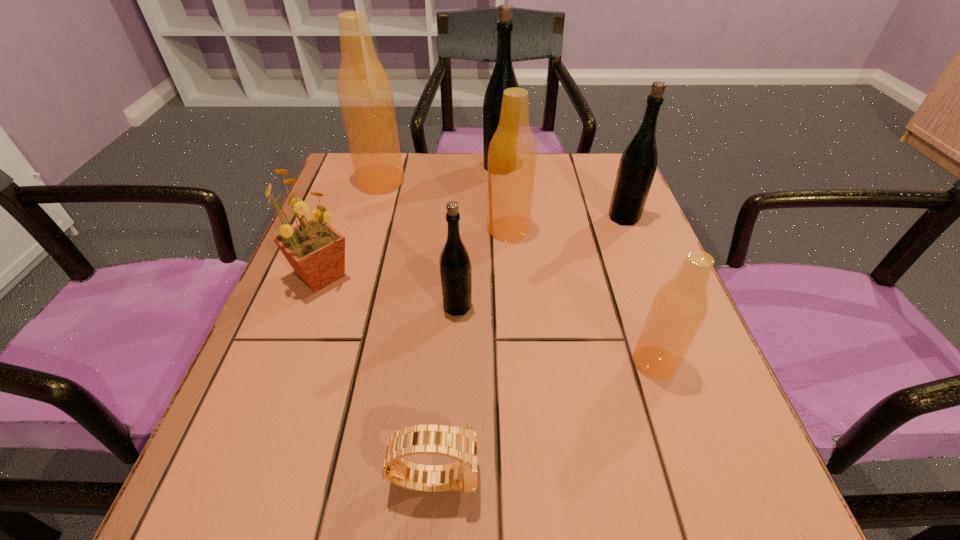
Image resolution: width=960 pixels, height=540 pixels. Identify the location of vacant space at the near left corner of the desktop. (282, 499).

Where is `blank area at the far right corner`? This screenshot has height=540, width=960. blank area at the far right corner is located at coordinates (597, 204).

Identify the location of vacant region at the near right corner. (664, 498).

Identify the location of vacant area between the second farthest green beer bottle and the second green beer bottle from left to right. Image resolution: width=960 pixels, height=540 pixels. 562,192.

Find the location of `free spot between the second nearest object and the leftmost beer bottle`. free spot between the second nearest object and the leftmost beer bottle is located at coordinates (517, 272).

You are a GUI agent. You are given a task and a screenshot of the screen. Output one action in this format:
    pyautogui.click(x=<x>, y=<y>)
    Task: Click on the vacant region between the shortest object and the leftmost beer bottle
    The width and height of the screenshot is (960, 540).
    Given the screenshot: What is the action you would take?
    pyautogui.click(x=408, y=329)

This screenshot has width=960, height=540. What are the coordinates of `vacant space that's between the black watch and the second smallest tan beer bottle` in the screenshot? It's located at (471, 353).

This screenshot has height=540, width=960. Find the location of `empty location between the leftmost beer bottle and the second green beer bottle from left to right`. empty location between the leftmost beer bottle and the second green beer bottle from left to right is located at coordinates (441, 174).

The height and width of the screenshot is (540, 960). I want to click on free space between the second smallest green beer bottle and the biggest green beer bottle, so click(562, 192).

At what (x,y) coordinates should I click in order to perform the action: click on free spot between the farthest tan beer bottle and the sunflower. Please return your answer as a coordinate pair (x, y). Looking at the image, I should click on (351, 229).